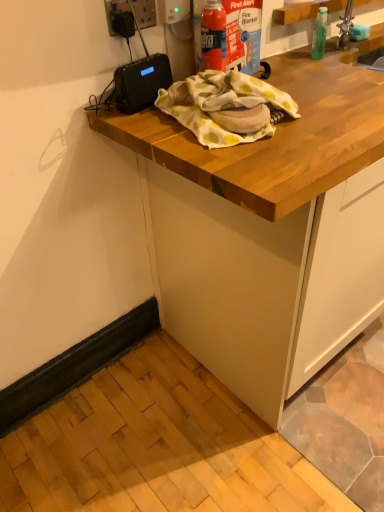
Question: From the image's perspective, is wooden countertop at upper center located above or below black plastic electric outlet at upper left?

Choices:
 (A) below
 (B) above

Answer: (A)

Question: From their relative heights in the image, would you say wooden countertop at upper center is taller or shorter than black plastic electric outlet at upper left?

Choices:
 (A) tall
 (B) short

Answer: (A)

Question: Relative to black plastic electric outlet at upper left, is wooden countertop at upper center in front or behind?

Choices:
 (A) behind
 (B) front

Answer: (B)

Question: Looking at the image, does black plastic electric outlet at upper left seem bigger or smaller compared to wooden countertop at upper center?

Choices:
 (A) big
 (B) small

Answer: (B)

Question: Is black plastic electric outlet at upper left in front of or behind wooden countertop at upper center in the image?

Choices:
 (A) behind
 (B) front

Answer: (A)

Question: Is black plastic electric outlet at upper left to the left or to the right of wooden countertop at upper center in the image?

Choices:
 (A) right
 (B) left

Answer: (B)

Question: From a real-world perspective, relative to wooden countertop at upper center, is black plastic electric outlet at upper left vertically above or below?

Choices:
 (A) above
 (B) below

Answer: (A)